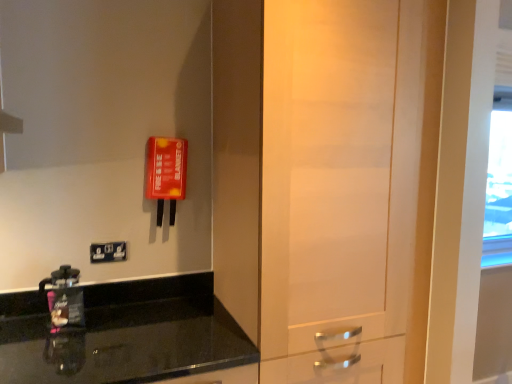
Question: Considering the relative sizes of matte black coffee maker at lower left and matte wood door at center in the image provided, is matte black coffee maker at lower left shorter than matte wood door at center?

Choices:
 (A) yes
 (B) no

Answer: (A)

Question: From the image's perspective, would you say matte black coffee maker at lower left is positioned over matte wood door at center?

Choices:
 (A) yes
 (B) no

Answer: (B)

Question: From the image's perspective, is matte black coffee maker at lower left under matte wood door at center?

Choices:
 (A) yes
 (B) no

Answer: (A)

Question: Could you tell me if matte black coffee maker at lower left is turned towards matte wood door at center?

Choices:
 (A) no
 (B) yes

Answer: (B)

Question: Is matte black coffee maker at lower left surrounding matte wood door at center?

Choices:
 (A) no
 (B) yes

Answer: (A)

Question: From a real-world perspective, is black granite countertop at lower left physically located above or below matte black coffee maker at lower left?

Choices:
 (A) above
 (B) below

Answer: (B)

Question: In the image, is black granite countertop at lower left positioned in front of or behind matte black coffee maker at lower left?

Choices:
 (A) behind
 (B) front

Answer: (B)

Question: Looking at the image, does black granite countertop at lower left seem bigger or smaller compared to matte black coffee maker at lower left?

Choices:
 (A) big
 (B) small

Answer: (A)

Question: From the image's perspective, is black granite countertop at lower left located above or below matte black coffee maker at lower left?

Choices:
 (A) below
 (B) above

Answer: (A)

Question: Is point (57, 273) closer or farther from the camera than point (111, 259)?

Choices:
 (A) closer
 (B) farther

Answer: (A)

Question: Is matte black coffee maker at lower left bigger or smaller than black plastic/light switch at lower left?

Choices:
 (A) big
 (B) small

Answer: (A)

Question: Is matte black coffee maker at lower left spatially inside black plastic/light switch at lower left, or outside of it?

Choices:
 (A) outside
 (B) inside

Answer: (A)

Question: From the image's perspective, is matte black coffee maker at lower left above or below black plastic/light switch at lower left?

Choices:
 (A) above
 (B) below

Answer: (B)

Question: Considering the positions of black granite countertop at lower left and matte wood door at center in the image, is black granite countertop at lower left taller or shorter than matte wood door at center?

Choices:
 (A) tall
 (B) short

Answer: (B)

Question: Does point (105, 291) appear closer or farther from the camera than point (238, 34)?

Choices:
 (A) closer
 (B) farther

Answer: (B)